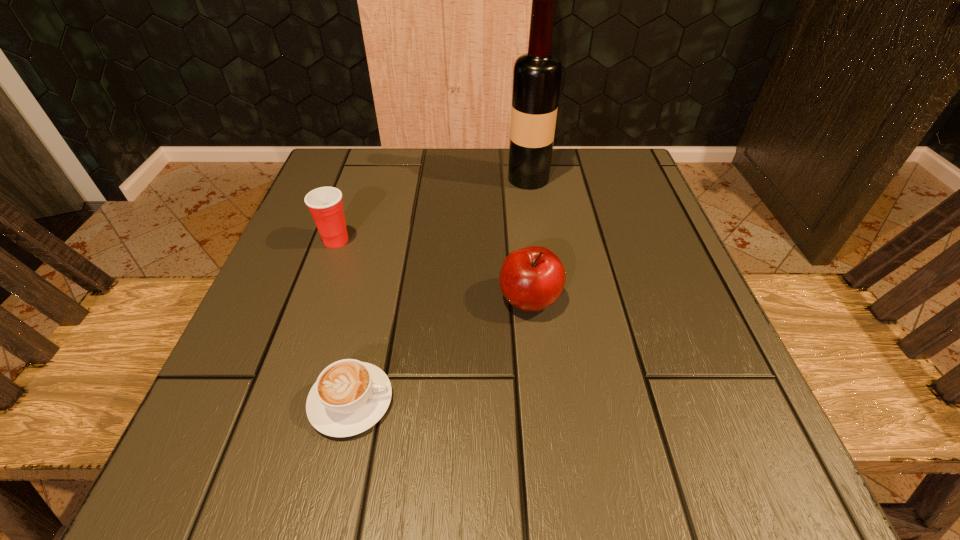
Find the location of a particular element. Image resolution: width=960 pixels, height=540 pixels. blank area located on the side of the shortest object with the handle is located at coordinates (472, 401).

Identify the location of object located at the far edge. This screenshot has width=960, height=540. [x=537, y=74].

Locate an element on the screen. object that is at the near edge is located at coordinates (349, 397).

At what (x,y) coordinates should I click in order to perform the action: click on Dixie cup that is at the left edge. Please return your answer as a coordinate pair (x, y). Looking at the image, I should click on (325, 204).

Find the location of `cappuccino positioned at the left edge`. cappuccino positioned at the left edge is located at coordinates (349, 397).

At what (x,y) coordinates should I click in order to perform the action: click on object that is at the near left corner. Please return your answer as a coordinate pair (x, y). The width and height of the screenshot is (960, 540). Looking at the image, I should click on (349, 397).

In the image, there is a desktop. Identify the location of free region at the far edge. The width and height of the screenshot is (960, 540). (456, 206).

Where is `vacant space at the near edge`? Image resolution: width=960 pixels, height=540 pixels. vacant space at the near edge is located at coordinates (351, 457).

You are a GUI agent. You are given a task and a screenshot of the screen. Output one action in this format:
    pyautogui.click(x=<x>, y=<y>)
    Task: Click on the vacant area at the left edge
    
    Given the screenshot: What is the action you would take?
    pyautogui.click(x=355, y=215)

The width and height of the screenshot is (960, 540). In the image, there is a desktop. Identify the location of blank space at the right edge. (630, 301).